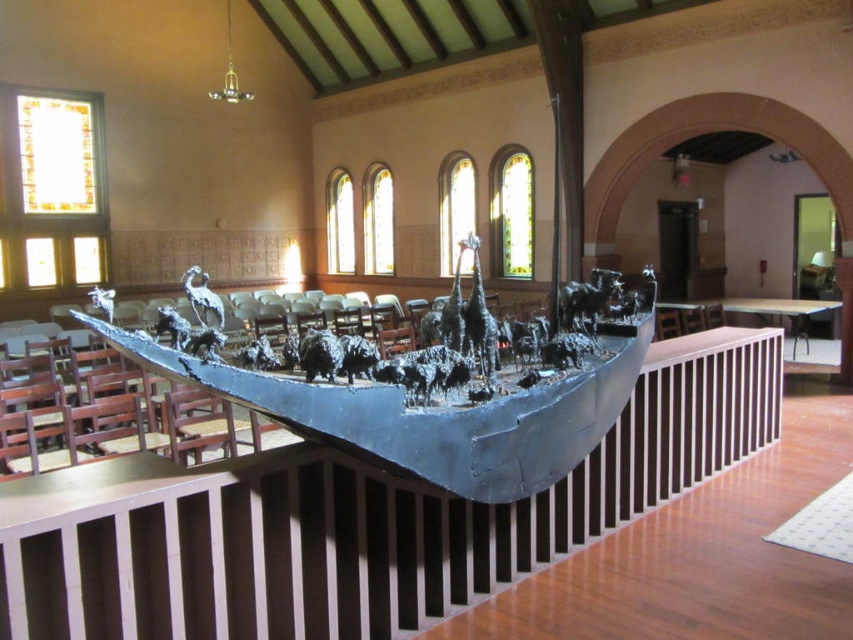
Question: Can you confirm if shiny metallic boat at center is positioned below shiny silver crane at center?

Choices:
 (A) yes
 (B) no

Answer: (A)

Question: Is shiny metallic boat at center further to the viewer compared to shiny silver crane at center?

Choices:
 (A) no
 (B) yes

Answer: (A)

Question: Among these points, which one is nearest to the camera?

Choices:
 (A) (207, 323)
 (B) (325, 408)

Answer: (B)

Question: Can you confirm if shiny metallic boat at center is smaller than shiny silver crane at center?

Choices:
 (A) no
 (B) yes

Answer: (B)

Question: Which object appears closest to the camera in this image?

Choices:
 (A) shiny silver crane at center
 (B) shiny metallic boat at center

Answer: (B)